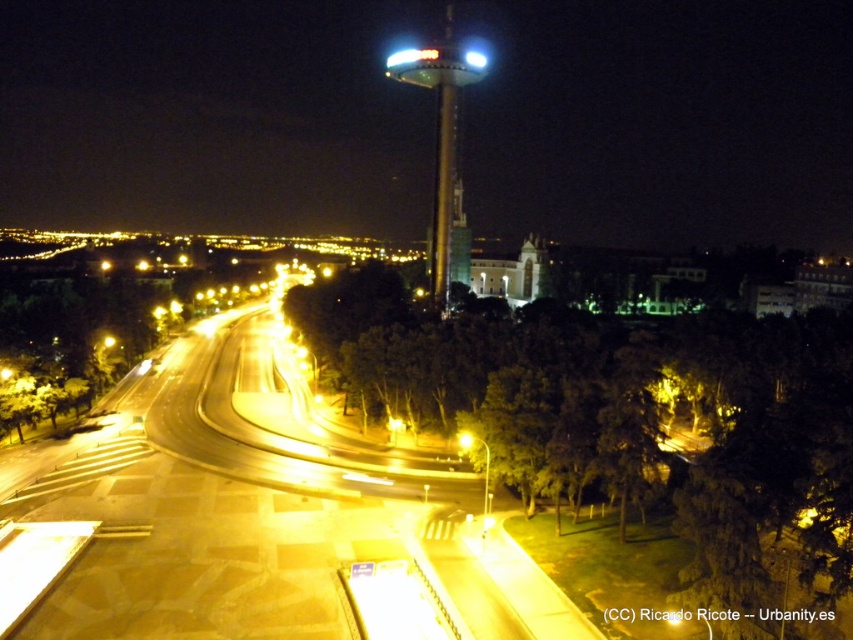
Looking at this image, which is below, shiny metallic tower at center or yellow metallic streetlight at center?

Positioned lower is yellow metallic streetlight at center.

Can you confirm if shiny metallic tower at center is shorter than yellow metallic streetlight at center?

In fact, shiny metallic tower at center may be taller than yellow metallic streetlight at center.

You are a GUI agent. You are given a task and a screenshot of the screen. Output one action in this format:
    pyautogui.click(x=<x>, y=<y>)
    Task: Click on the shiny metallic tower at center
    Image resolution: width=853 pixels, height=640 pixels.
    Given the screenshot: What is the action you would take?
    pyautogui.click(x=440, y=138)

You are a GUI agent. You are given a task and a screenshot of the screen. Output one action in this format:
    pyautogui.click(x=<x>, y=<y>)
    Task: Click on the shiny metallic tower at center
    
    Given the screenshot: What is the action you would take?
    pyautogui.click(x=440, y=138)